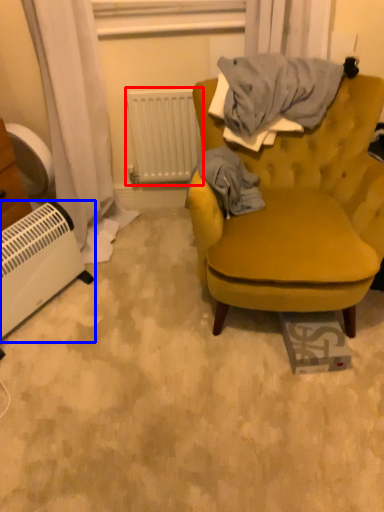
Question: Which point is further to the camera, radiator (highlighted by a red box) or appliance (highlighted by a blue box)?

Choices:
 (A) radiator
 (B) appliance

Answer: (A)